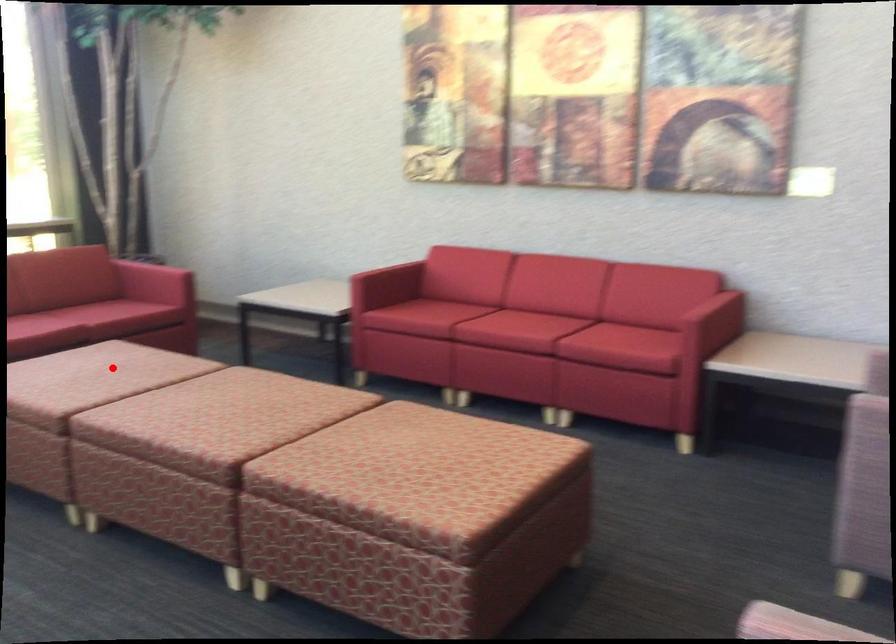
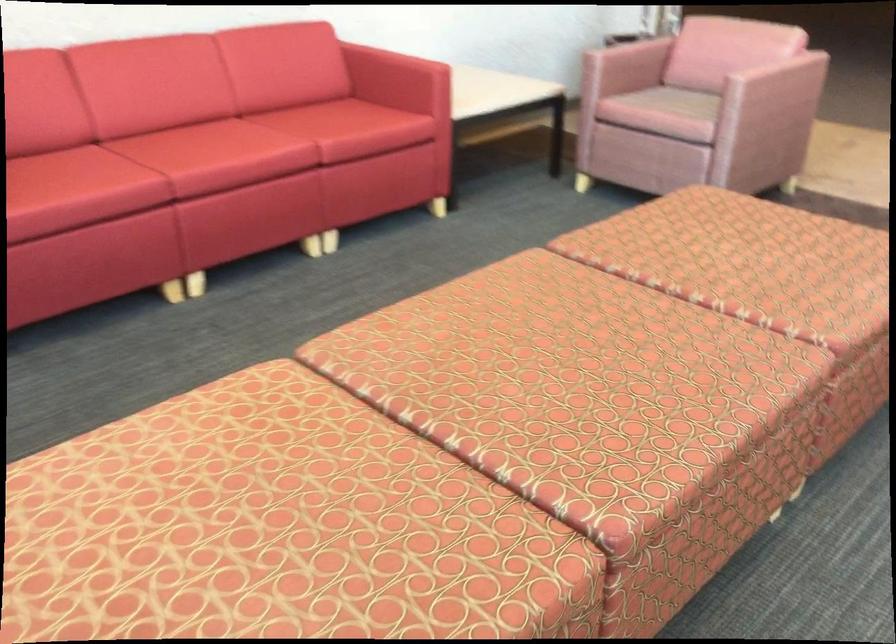
Question: I am providing you with two images of the same scene from different viewpoints. A red point is shown in image1. For the corresponding object point in image2, is it positioned nearer or farther from the camera?

Choices:
 (A) Nearer
 (B) Farther

Answer: (A)